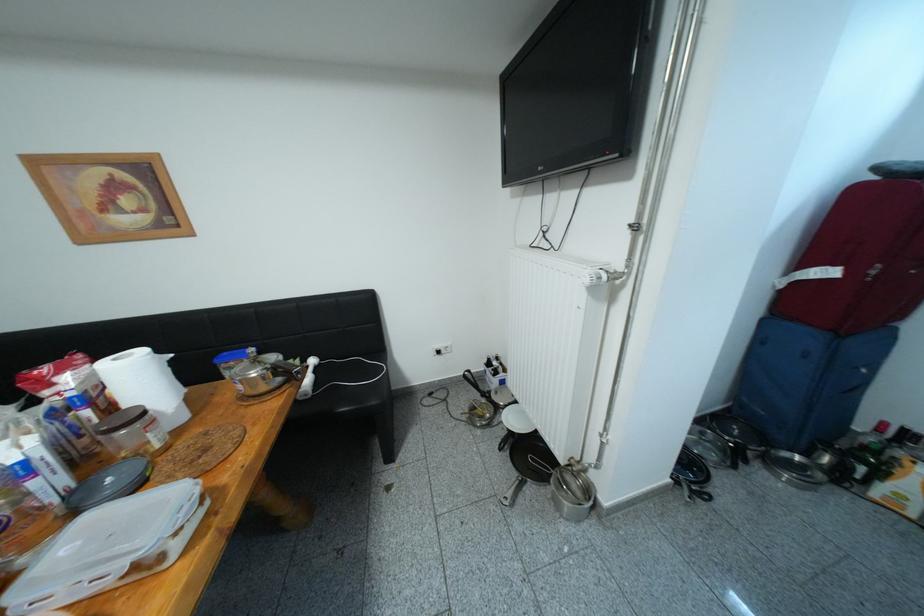
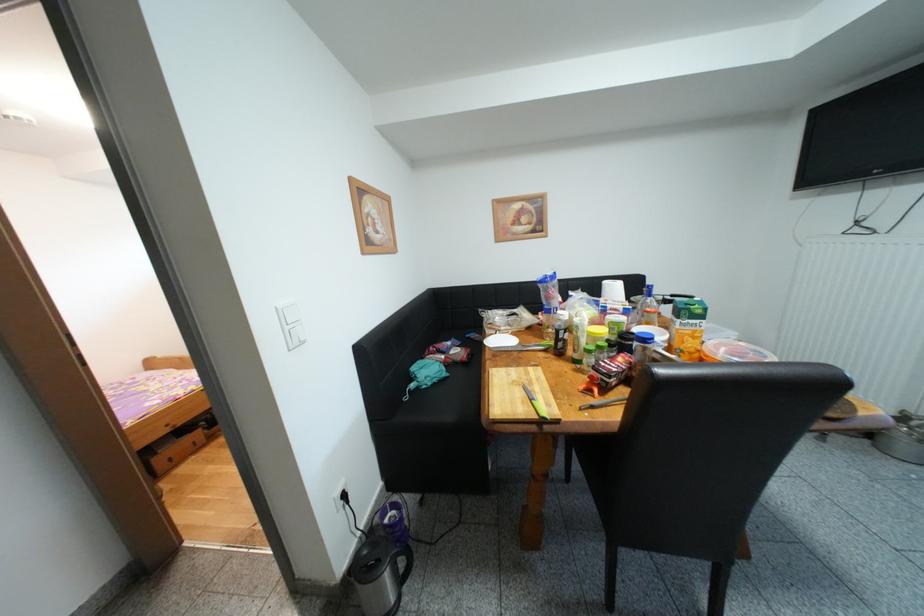
In a continuous first-person perspective shot, in which direction is the camera moving?

The movement direction of the cameraman is left, backward.